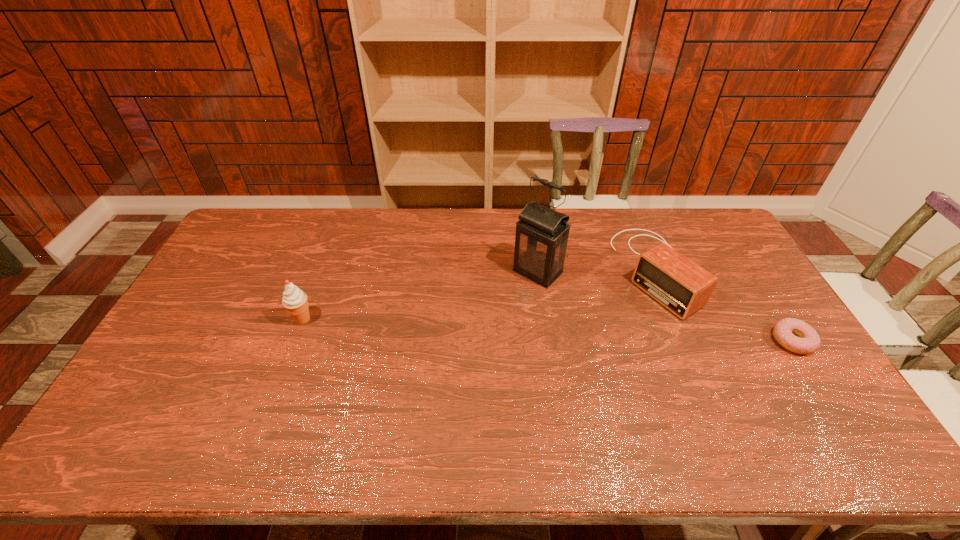
Image resolution: width=960 pixels, height=540 pixels. What are the coordinates of `free space on the desktop that is between the leftmost object and the doughnut and is positioned on the front-facing side of the third object from right to left` in the screenshot? It's located at (480, 327).

This screenshot has width=960, height=540. Find the location of `vacant spot on the desktop that is between the leftmost object and the rightmost object and is positioned on the front-facing side of the radio receiver`. vacant spot on the desktop that is between the leftmost object and the rightmost object and is positioned on the front-facing side of the radio receiver is located at coordinates (549, 330).